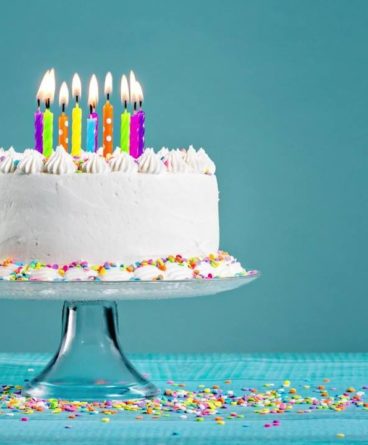
Locate an element on the screen. This screenshot has width=368, height=445. birthday cake candles is located at coordinates (37, 131), (45, 135), (62, 135), (77, 136), (88, 136), (95, 115), (106, 128), (120, 128), (134, 135), (141, 129).